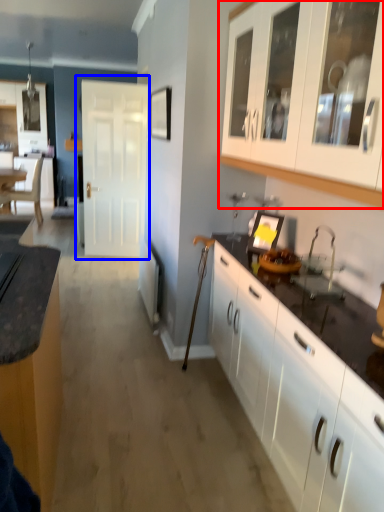
Question: Which object is further to the camera taking this photo, cabinetry (highlighted by a red box) or door (highlighted by a blue box)?

Choices:
 (A) cabinetry
 (B) door

Answer: (B)